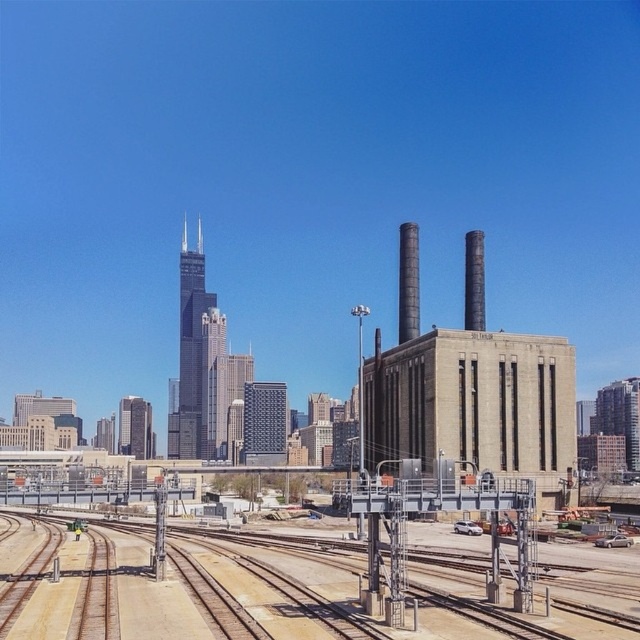
Is brown wooden track at lower center to the left of metallic gray power station at center from the viewer's perspective?

Indeed, brown wooden track at lower center is positioned on the left side of metallic gray power station at center.

Does brown wooden track at lower center have a greater height compared to metallic gray power station at center?

Incorrect, brown wooden track at lower center's height is not larger of metallic gray power station at center's.

What do you see at coordinates (234, 592) in the screenshot? I see `brown wooden track at lower center` at bounding box center [234, 592].

Locate an element on the screen. brown wooden track at lower center is located at coordinates (234, 592).